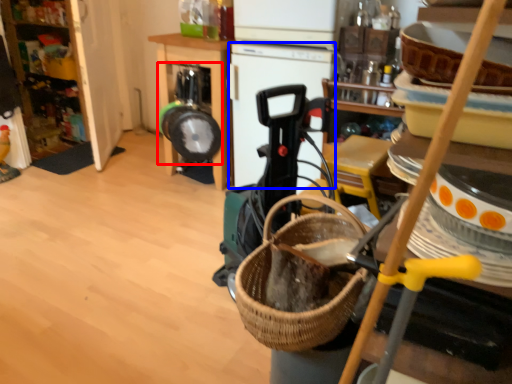
Question: Which point is further to the camera, appliance (highlighted by a red box) or appliance (highlighted by a blue box)?

Choices:
 (A) appliance
 (B) appliance

Answer: (A)